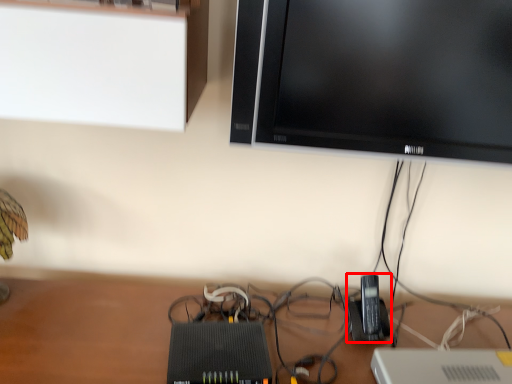
Question: Where is gadget (annotated by the red box) located in relation to television in the image?

Choices:
 (A) left
 (B) right

Answer: (A)